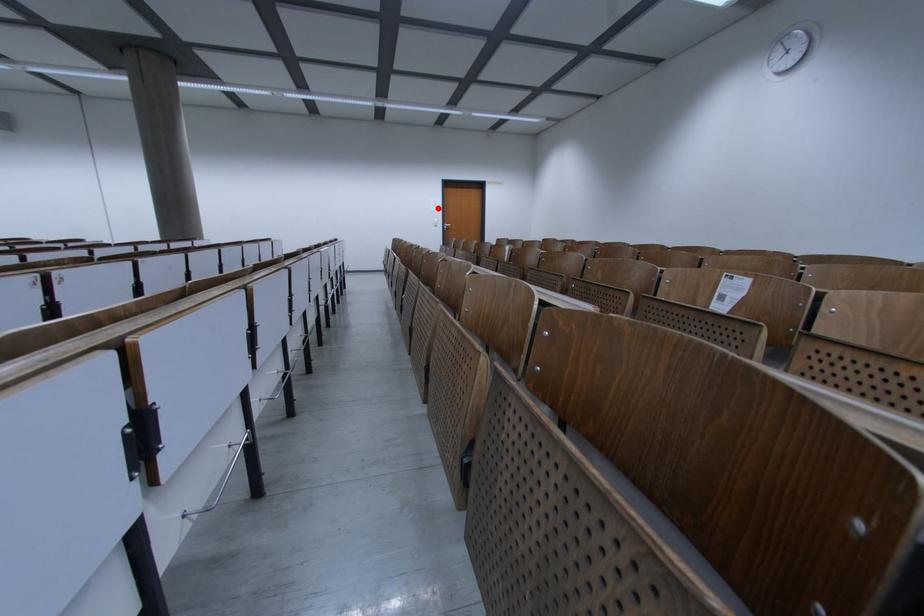
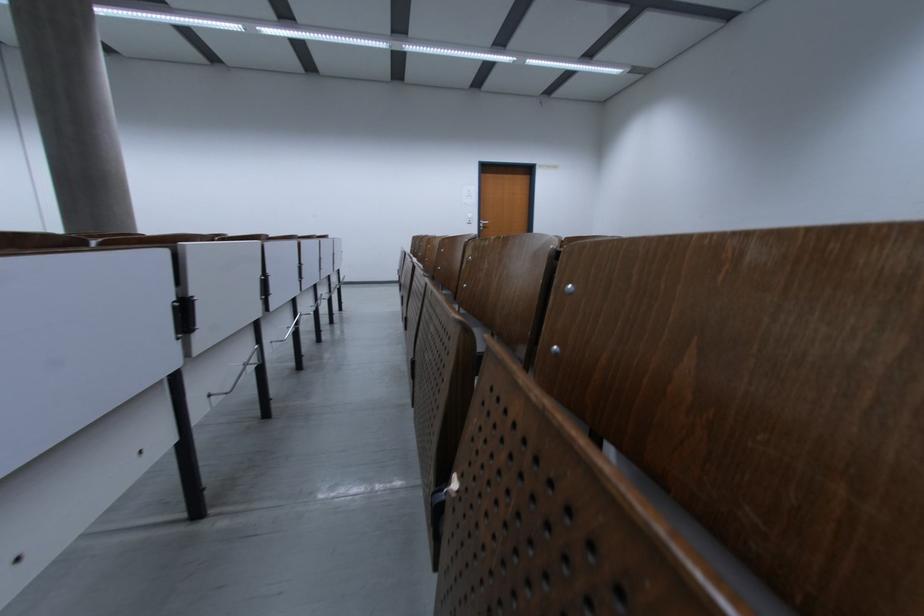
The point at the highlighted location is marked in the first image. Where is the corresponding point in the second image?

(470, 199)